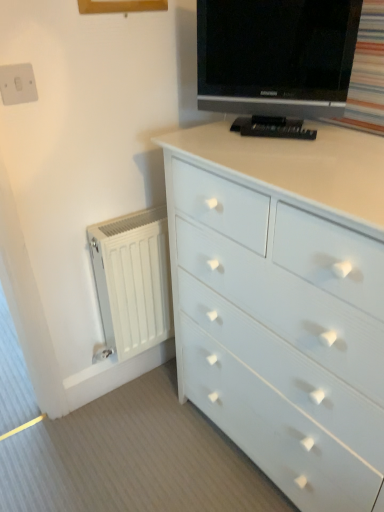
Find the location of a particular element. free location above white matte radiator at left (from a real-world perspective) is located at coordinates (127, 222).